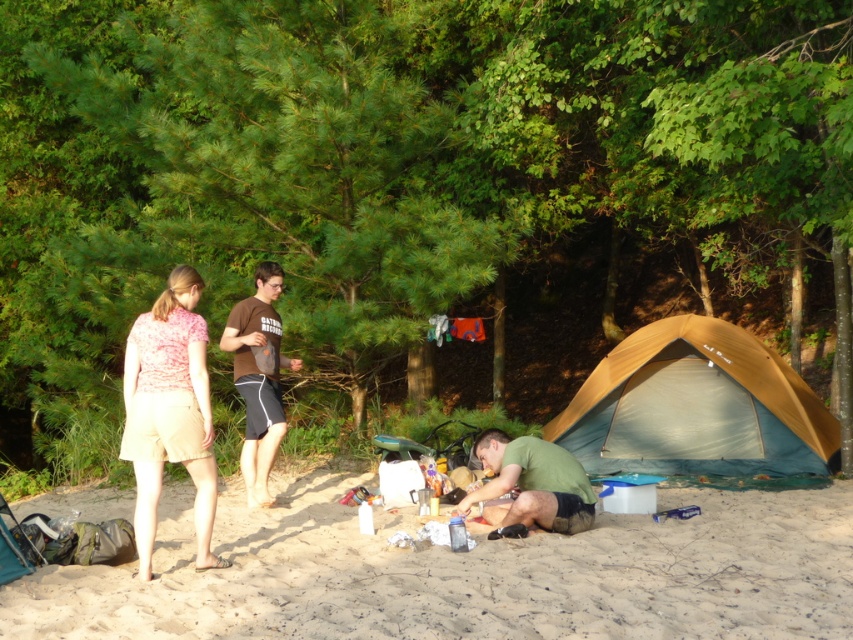
Question: Does pink fabric shorts at lower left have a greater width compared to green matte shirt at lower center?

Choices:
 (A) no
 (B) yes

Answer: (A)

Question: Among these objects, which one is nearest to the camera?

Choices:
 (A) fine-grained sand at lower center
 (B) pink fabric shorts at lower left
 (C) tan fabric tent at lower right

Answer: (A)

Question: Which point is closer to the camera?

Choices:
 (A) (349, 595)
 (B) (247, 500)

Answer: (A)

Question: Which point is farther to the camera?

Choices:
 (A) (761, 593)
 (B) (643, 419)
 (C) (552, 452)
 (D) (229, 336)

Answer: (B)

Question: Where is tan fabric tent at lower right located in relation to brown cotton t-shirt at center in the image?

Choices:
 (A) below
 (B) above

Answer: (A)

Question: Is fine-grained sand at lower center wider than brown cotton t-shirt at center?

Choices:
 (A) yes
 (B) no

Answer: (A)